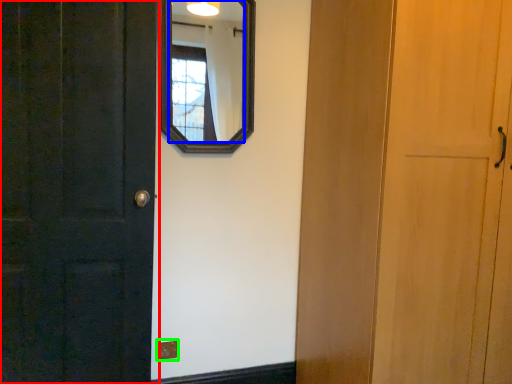
Question: Based on their relative distances, which object is farther from door (highlighted by a red box)? Choose from mirror (highlighted by a blue box) and electric outlet (highlighted by a green box).

Choices:
 (A) mirror
 (B) electric outlet

Answer: (A)